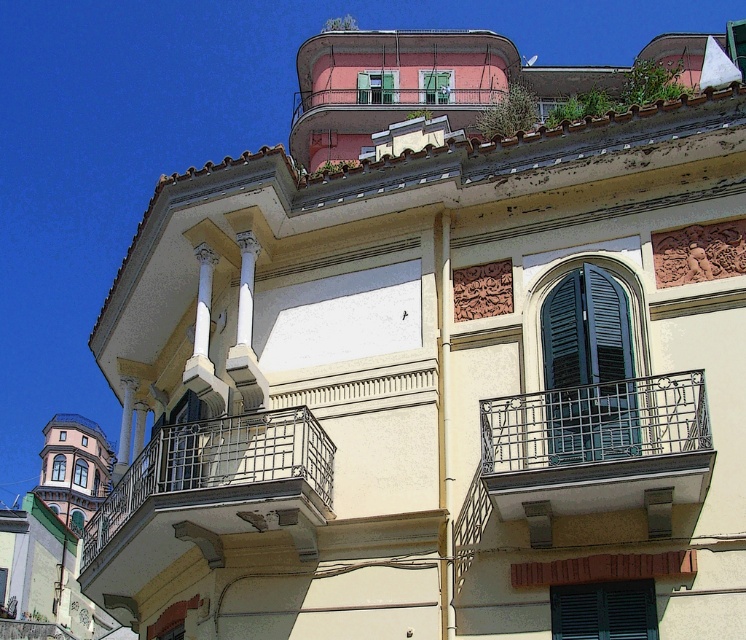
Can you confirm if green matte shutters at center is thinner than green matte shutter at lower center?

Yes.

Who is positioned more to the left, green matte shutters at center or green matte shutter at lower center?

From the viewer's perspective, green matte shutter at lower center appears more on the left side.

The height and width of the screenshot is (640, 746). What are the coordinates of `green matte shutters at center` in the screenshot? It's located at (586, 369).

Does silver metallic balcony at center have a lesser width compared to black wrought iron balcony at center?

No, silver metallic balcony at center is not thinner than black wrought iron balcony at center.

Which of these two, silver metallic balcony at center or black wrought iron balcony at center, stands shorter?

black wrought iron balcony at center

You are a GUI agent. You are given a task and a screenshot of the screen. Output one action in this format:
    pyautogui.click(x=<x>, y=<y>)
    Task: Click on the silver metallic balcony at center
    The height and width of the screenshot is (640, 746).
    Given the screenshot: What is the action you would take?
    pyautogui.click(x=213, y=488)

From the picture: Measure the distance from silver metallic balcony at center to green matte shutters at center.

silver metallic balcony at center and green matte shutters at center are 47.43 feet apart from each other.

Which of these two, silver metallic balcony at center or green matte shutters at center, stands shorter?

Standing shorter between the two is green matte shutters at center.

Describe the element at coordinates (213, 488) in the screenshot. This screenshot has width=746, height=640. I see `silver metallic balcony at center` at that location.

At what (x,y) coordinates should I click in order to perform the action: click on silver metallic balcony at center. Please return your answer as a coordinate pair (x, y). Looking at the image, I should click on (213, 488).